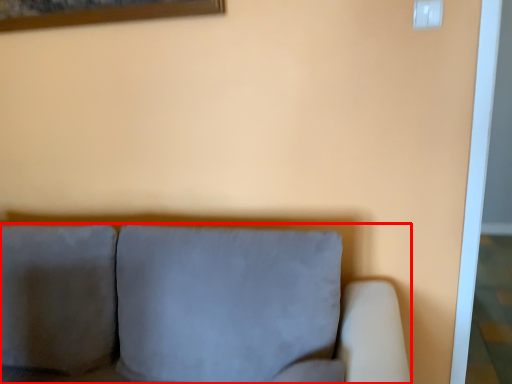
Question: In this image, where is studio couch (annotated by the red box) located relative to electric outlet?

Choices:
 (A) left
 (B) right

Answer: (A)